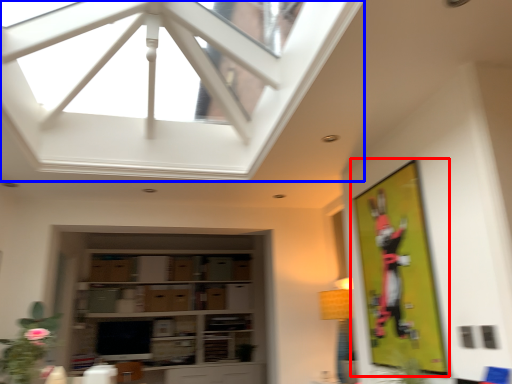
Question: Which object is closer to the camera taking this photo, bulletin board (highlighted by a red box) or window (highlighted by a blue box)?

Choices:
 (A) bulletin board
 (B) window

Answer: (B)